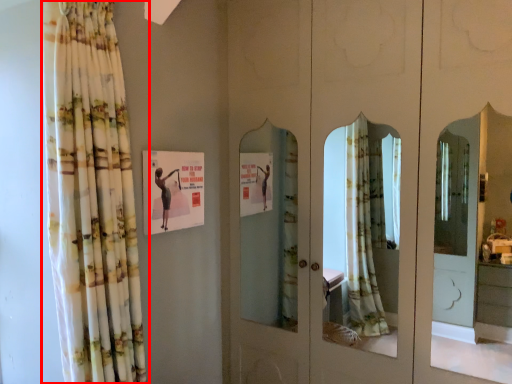
Question: From the image's perspective, where is curtain (annotated by the red box) located relative to postcard?

Choices:
 (A) below
 (B) above

Answer: (A)